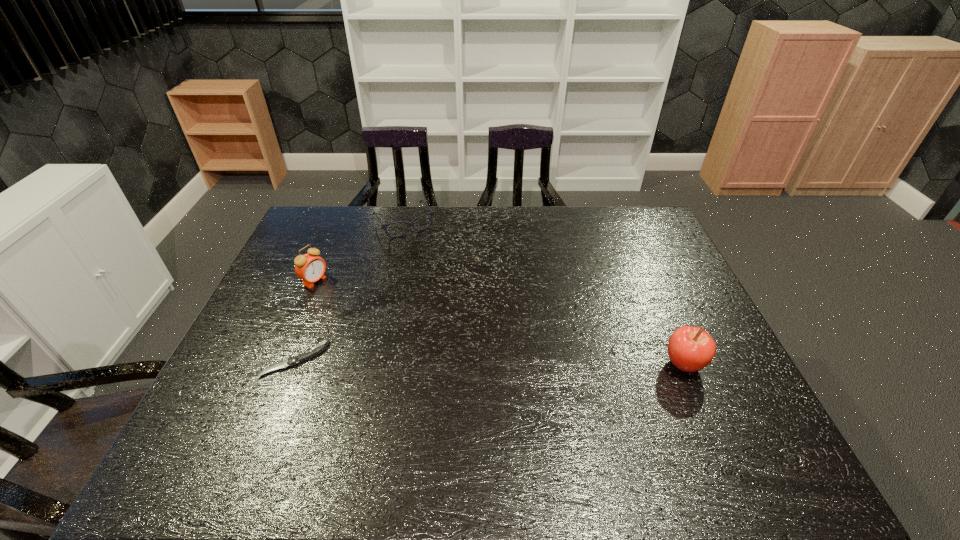
The width and height of the screenshot is (960, 540). What are the coordinates of `vacant space on the desktop that is between the shortest object and the rightmost object and is positioned on the front-facing side of the spectacles` in the screenshot? It's located at (498, 362).

You are a GUI agent. You are given a task and a screenshot of the screen. Output one action in this format:
    pyautogui.click(x=<x>, y=<y>)
    Task: Click on the free space on the desktop that is between the shortest object and the rightmost object and is positioned on the face of the second farthest object
    
    Given the screenshot: What is the action you would take?
    pyautogui.click(x=464, y=362)